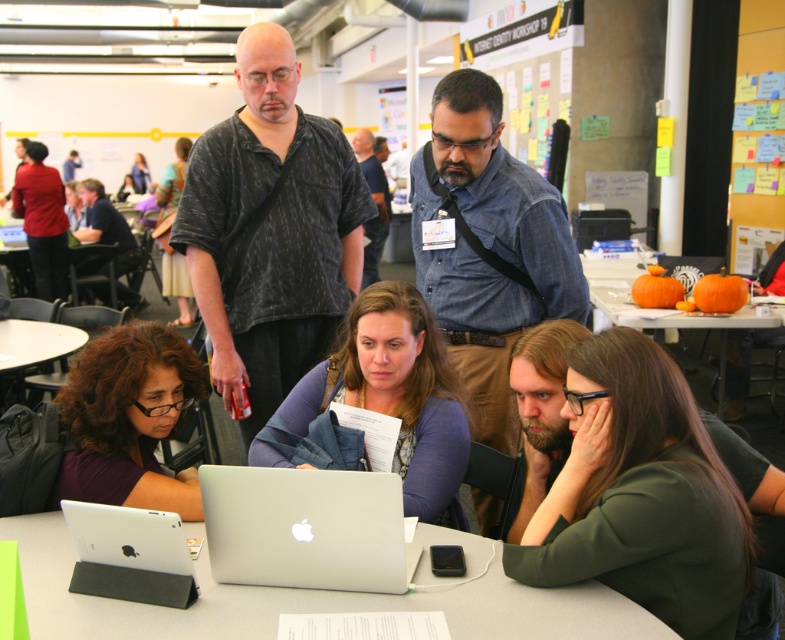
Between orange pumpkin at upper right and white plastic table at lower left, which one appears on the left side from the viewer's perspective?

Positioned to the left is white plastic table at lower left.

Which of these two, orange pumpkin at upper right or white plastic table at lower left, stands taller?

Standing taller between the two is orange pumpkin at upper right.

Is point (725, 317) positioned in front of point (24, 342)?

No, (725, 317) is further to viewer.

Image resolution: width=785 pixels, height=640 pixels. In order to click on orange pumpkin at upper right in this screenshot , I will do `click(676, 321)`.

Does white matte tablet at lower left appear over yellow sticky notes at upper right?

No, white matte tablet at lower left is not above yellow sticky notes at upper right.

Can you confirm if white matte tablet at lower left is wider than yellow sticky notes at upper right?

Yes.

Locate an element on the screen. This screenshot has width=785, height=640. white matte tablet at lower left is located at coordinates click(128, 536).

Does point (473, 157) come farther from viewer compared to point (89, 525)?

That is True.

Which is in front, point (564, 266) or point (148, 538)?

Point (148, 538) is in front.

Identify the location of denim shirt at center. (487, 248).